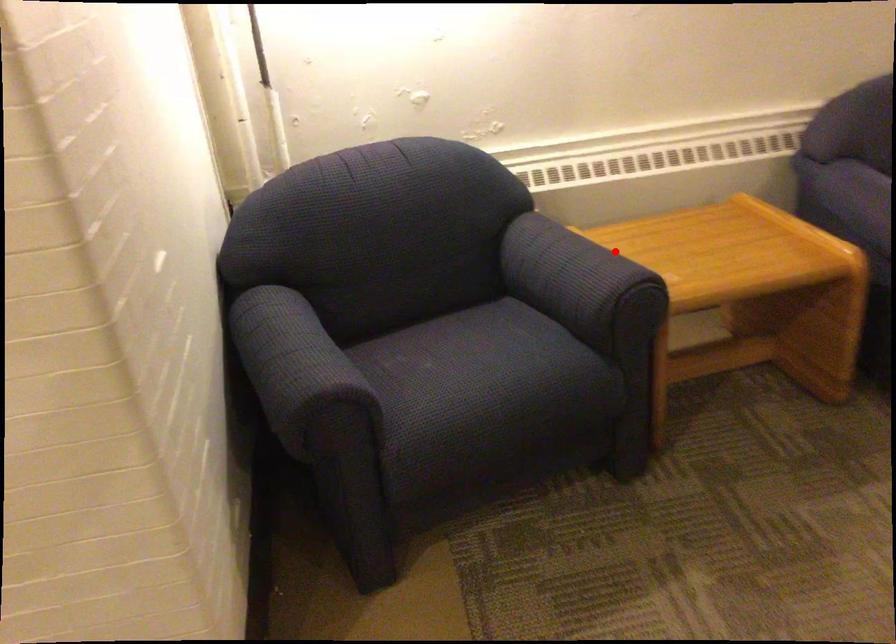
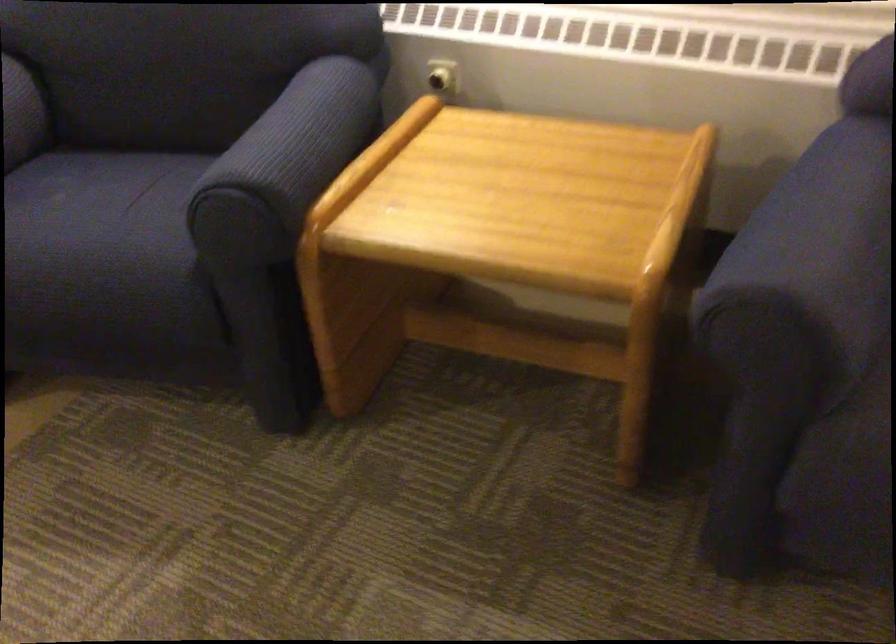
Question: I am providing you with two images of the same scene from different viewpoints. A red point is marked on the first image. Is the red point's position out of view in image 2?

Choices:
 (A) Yes
 (B) No

Answer: (B)